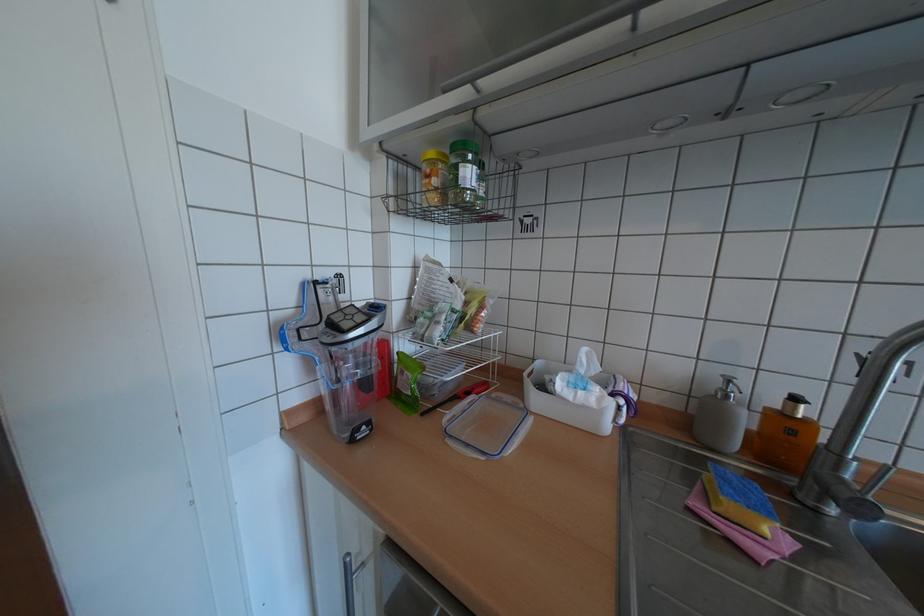
Identify the location of the lower cabinet handle. Image resolution: width=924 pixels, height=616 pixels. (349, 582).